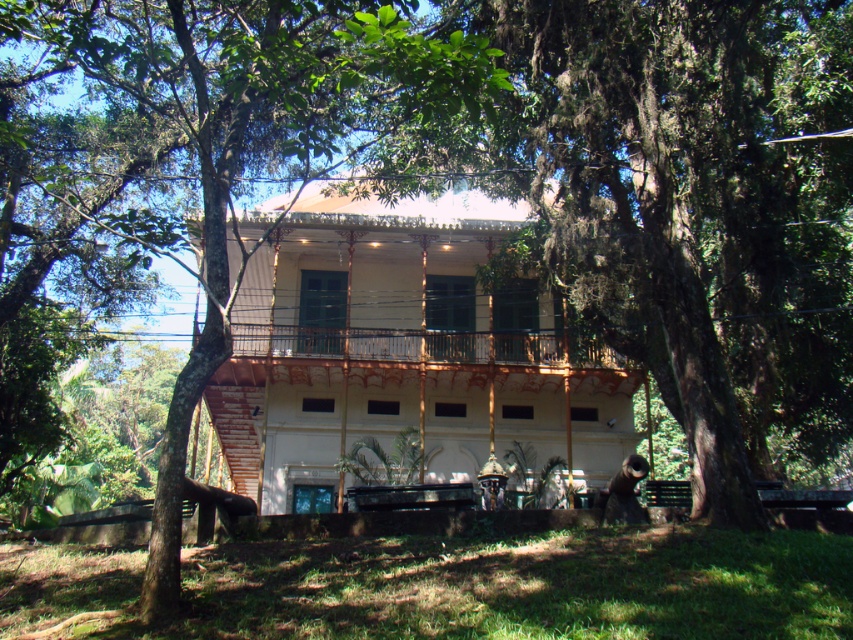
Is green leafy tree at center to the left of rustic wood porch at center from the viewer's perspective?

Yes, green leafy tree at center is to the left of rustic wood porch at center.

Is point (291, 68) positioned behind point (410, 360)?

That is False.

At what (x,y) coordinates should I click in order to perform the action: click on green leafy tree at center. Please return your answer as a coordinate pair (x, y). Looking at the image, I should click on (281, 138).